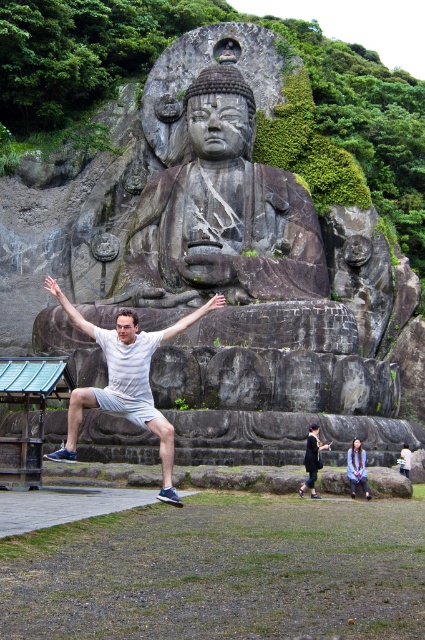
You are a photographer wanting to capture the gray stone statue at center and the black fabric bag at lower center in a single frame. Based on their positions, which object should you focus on first to ensure both are in focus?

The gray stone statue at center is located above the black fabric bag at lower center, so focusing on the gray stone statue at center first will help ensure both are in focus since it is farther away and occupies a larger depth of field.